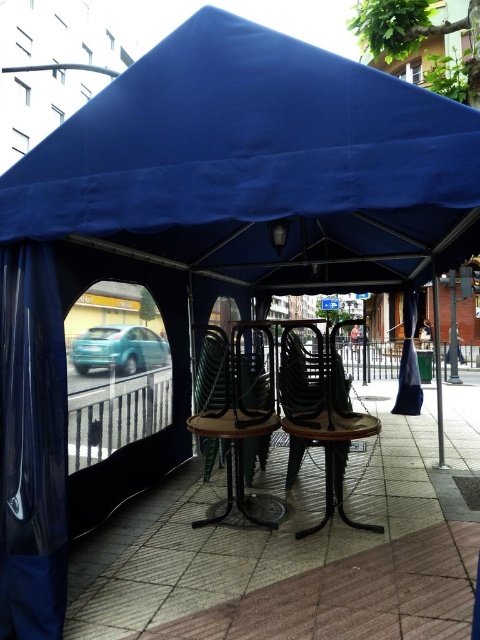
Question: Which is nearer to the blue sheer curtain at left?

Choices:
 (A) blue fabric canopy at upper center
 (B) wooden chair at center
 (C) smooth concrete pavement at center
 (D) metallic brown chair at center

Answer: (C)

Question: Which point appears farthest from the camera in this image?

Choices:
 (A) (204, 436)
 (B) (309, 237)
 (C) (51, 397)
 (D) (369, 419)

Answer: (B)

Question: Does metallic brown chair at center appear on the left side of wooden chair at center?

Choices:
 (A) yes
 (B) no

Answer: (A)

Question: Is blue fabric canopy at upper center thinner than smooth concrete pavement at center?

Choices:
 (A) yes
 (B) no

Answer: (B)

Question: Which of the following is the closest to the observer?

Choices:
 (A) pos(415,273)
 (B) pos(59,477)
 (C) pos(271,339)
 (D) pos(294,346)

Answer: (B)

Question: Is blue fabric canopy at upper center further to camera compared to metallic brown chair at center?

Choices:
 (A) no
 (B) yes

Answer: (B)